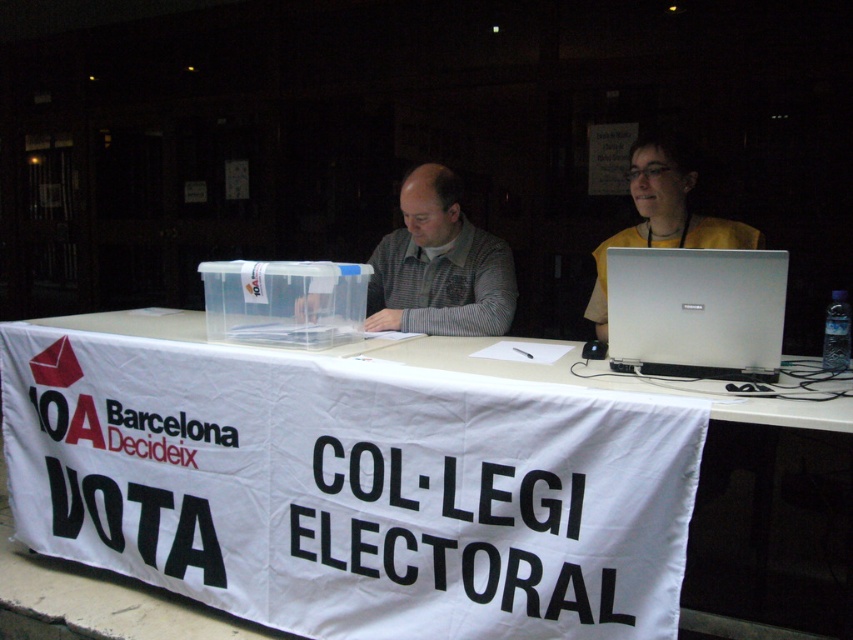
Which is in front, point (627, 268) or point (717, 516)?

Point (627, 268) is more forward.

Is point (683, 250) positioned after point (776, 404)?

Yes.

Is point (659, 365) less distant than point (776, 422)?

No, it is behind (776, 422).

I want to click on silver metallic laptop at center, so click(x=695, y=310).

Does silver metallic laptop at center have a lesser width compared to yellow matte shirt at upper right?

Correct, silver metallic laptop at center's width is less than yellow matte shirt at upper right's.

Between silver metallic laptop at center and yellow matte shirt at upper right, which one is positioned higher?

yellow matte shirt at upper right

Which is behind, point (607, 340) or point (602, 248)?

Point (602, 248)

At what (x,y) coordinates should I click in order to perform the action: click on silver metallic laptop at center. Please return your answer as a coordinate pair (x, y). Looking at the image, I should click on (695, 310).

Does point (492, 304) come behind point (727, 220)?

Yes, it is.

Can you confirm if gray knitted sweater at center is positioned below yellow matte shirt at upper right?

Indeed, gray knitted sweater at center is positioned under yellow matte shirt at upper right.

Where is `gray knitted sweater at center`? The width and height of the screenshot is (853, 640). gray knitted sweater at center is located at coordinates (439, 266).